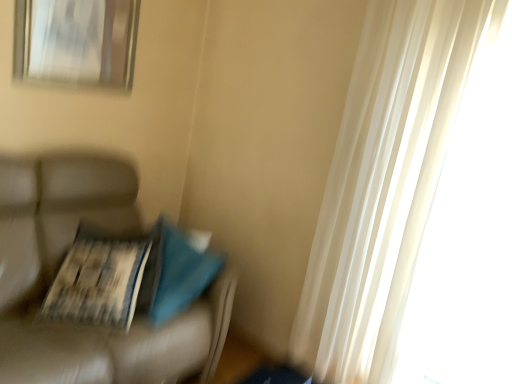
Question: Is printed paper magazine at left closer to camera compared to leather couch at left?

Choices:
 (A) no
 (B) yes

Answer: (A)

Question: Can you confirm if printed paper magazine at left is smaller than leather couch at left?

Choices:
 (A) yes
 (B) no

Answer: (A)

Question: Is printed paper magazine at left taller than leather couch at left?

Choices:
 (A) yes
 (B) no

Answer: (B)

Question: Is printed paper magazine at left outside leather couch at left?

Choices:
 (A) no
 (B) yes

Answer: (A)

Question: Is printed paper magazine at left facing away from leather couch at left?

Choices:
 (A) no
 (B) yes

Answer: (B)

Question: From their relative heights in the image, would you say printed paper magazine at left is taller or shorter than leather couch at left?

Choices:
 (A) short
 (B) tall

Answer: (A)

Question: From the image's perspective, relative to leather couch at left, is printed paper magazine at left above or below?

Choices:
 (A) below
 (B) above

Answer: (B)

Question: Is printed paper magazine at left inside the boundaries of leather couch at left, or outside?

Choices:
 (A) outside
 (B) inside

Answer: (B)

Question: Considering the relative positions of printed paper magazine at left and leather couch at left in the image provided, is printed paper magazine at left to the left or to the right of leather couch at left?

Choices:
 (A) right
 (B) left

Answer: (A)

Question: Is printed paper magazine at left inside the boundaries of metallic silver picture frame at upper left, or outside?

Choices:
 (A) outside
 (B) inside

Answer: (A)

Question: Based on their sizes in the image, would you say printed paper magazine at left is bigger or smaller than metallic silver picture frame at upper left?

Choices:
 (A) small
 (B) big

Answer: (B)

Question: Considering the relative positions of printed paper magazine at left and metallic silver picture frame at upper left in the image provided, is printed paper magazine at left to the left or to the right of metallic silver picture frame at upper left?

Choices:
 (A) right
 (B) left

Answer: (A)

Question: Considering the positions of printed paper magazine at left and metallic silver picture frame at upper left in the image, is printed paper magazine at left wider or thinner than metallic silver picture frame at upper left?

Choices:
 (A) wide
 (B) thin

Answer: (A)

Question: From a real-world perspective, relative to printed paper magazine at left, is metallic silver picture frame at upper left vertically above or below?

Choices:
 (A) below
 (B) above

Answer: (B)

Question: From the image's perspective, is metallic silver picture frame at upper left positioned above or below printed paper magazine at left?

Choices:
 (A) below
 (B) above

Answer: (B)